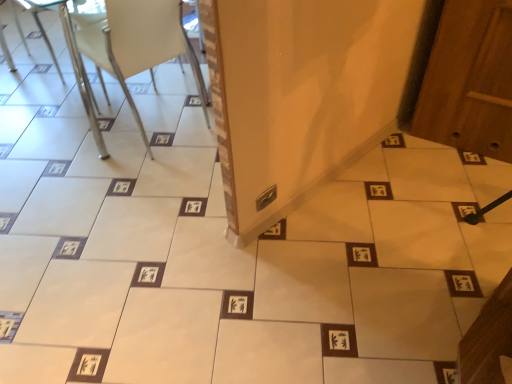
From the picture: What is the approximate height of metallic silver chair at upper left?

The height of metallic silver chair at upper left is 47.52 centimeters.

Find the location of a particular element. Image resolution: width=512 pixels, height=384 pixels. metallic silver chair at upper left is located at coordinates tap(41, 23).

This screenshot has width=512, height=384. What do you see at coordinates (41, 23) in the screenshot?
I see `metallic silver chair at upper left` at bounding box center [41, 23].

Locate an element on the screen. The height and width of the screenshot is (384, 512). white plastic chair at upper left is located at coordinates (139, 45).

Describe the element at coordinates (139, 45) in the screenshot. I see `white plastic chair at upper left` at that location.

What is the approximate height of white plastic chair at upper left?

It is 28.96 inches.

You are a GUI agent. You are given a task and a screenshot of the screen. Output one action in this format:
    pyautogui.click(x=<x>, y=<y>)
    Task: Click on the metallic silver chair at upper left
    Image resolution: width=512 pixels, height=384 pixels.
    Given the screenshot: What is the action you would take?
    pyautogui.click(x=41, y=23)

In the image, is white plastic chair at upper left on the left side or the right side of metallic silver chair at upper left?

white plastic chair at upper left is to the right of metallic silver chair at upper left.

Is white plastic chair at upper left in front of or behind metallic silver chair at upper left in the image?

white plastic chair at upper left is positioned closer to the viewer than metallic silver chair at upper left.

Which is nearer, (114, 63) or (31, 7)?

Point (114, 63).

From the image's perspective, would you say white plastic chair at upper left is shown under metallic silver chair at upper left?

Correct, white plastic chair at upper left appears lower than metallic silver chair at upper left in the image.

From a real-world perspective, is white plastic chair at upper left located higher than metallic silver chair at upper left?

Correct, in the physical world, white plastic chair at upper left is higher than metallic silver chair at upper left.

Can you confirm if white plastic chair at upper left is wider than metallic silver chair at upper left?

Yes.

In the scene shown: Between white plastic chair at upper left and metallic silver chair at upper left, which one has less height?

With less height is metallic silver chair at upper left.

Based on their sizes in the image, would you say white plastic chair at upper left is bigger or smaller than metallic silver chair at upper left?

Clearly, white plastic chair at upper left is larger in size than metallic silver chair at upper left.

Is white plastic chair at upper left completely or partially outside of metallic silver chair at upper left?

Absolutely, white plastic chair at upper left is external to metallic silver chair at upper left.

Are white plastic chair at upper left and metallic silver chair at upper left making contact?

white plastic chair at upper left is not next to metallic silver chair at upper left, and they're not touching.

Is white plastic chair at upper left facing away from metallic silver chair at upper left?

Yes, white plastic chair at upper left is positioned with its back facing metallic silver chair at upper left.

What's the angular difference between white plastic chair at upper left and metallic silver chair at upper left's facing directions?

The facing directions of white plastic chair at upper left and metallic silver chair at upper left are 3.3 degrees apart.

This screenshot has height=384, width=512. I want to click on armchair on the left of white plastic chair at upper left, so click(41, 23).

Which object is positioned more to the right, metallic silver chair at upper left or white plastic chair at upper left?

white plastic chair at upper left.

Who is more distant, metallic silver chair at upper left or white plastic chair at upper left?

metallic silver chair at upper left is further from the camera.

Which is behind, point (11, 3) or point (183, 41)?

The point (11, 3) is farther from the camera.

From the image's perspective, between metallic silver chair at upper left and white plastic chair at upper left, which one is located above?

From the image's view, metallic silver chair at upper left is above.

From a real-world perspective, relative to white plastic chair at upper left, is metallic silver chair at upper left vertically above or below?

Clearly, from a real-world perspective, metallic silver chair at upper left is below white plastic chair at upper left.

Considering the relative sizes of metallic silver chair at upper left and white plastic chair at upper left in the image provided, is metallic silver chair at upper left thinner than white plastic chair at upper left?

Yes.

Considering the relative sizes of metallic silver chair at upper left and white plastic chair at upper left in the image provided, is metallic silver chair at upper left taller than white plastic chair at upper left?

No.

In terms of size, does metallic silver chair at upper left appear bigger or smaller than white plastic chair at upper left?

Clearly, metallic silver chair at upper left is smaller in size than white plastic chair at upper left.

Would you say metallic silver chair at upper left is outside white plastic chair at upper left?

metallic silver chair at upper left is positioned outside white plastic chair at upper left.

Is metallic silver chair at upper left placed right next to white plastic chair at upper left?

No, metallic silver chair at upper left is not making contact with white plastic chair at upper left.

Is metallic silver chair at upper left facing away from white plastic chair at upper left?

No.

In the scene shown: Can you tell me how much metallic silver chair at upper left and white plastic chair at upper left differ in facing direction?

The angular difference between metallic silver chair at upper left and white plastic chair at upper left is 3.3 degrees.

How much distance is there between metallic silver chair at upper left and white plastic chair at upper left?

metallic silver chair at upper left is 86.09 centimeters away from white plastic chair at upper left.

I want to click on armchair that appears above the white plastic chair at upper left (from the image's perspective), so pyautogui.click(x=41, y=23).

What are the coordinates of `armchair below the white plastic chair at upper left (from a real-world perspective)` in the screenshot? It's located at (41, 23).

Where is `chair that appears on the right of metallic silver chair at upper left`? The width and height of the screenshot is (512, 384). chair that appears on the right of metallic silver chair at upper left is located at coordinates point(139,45).